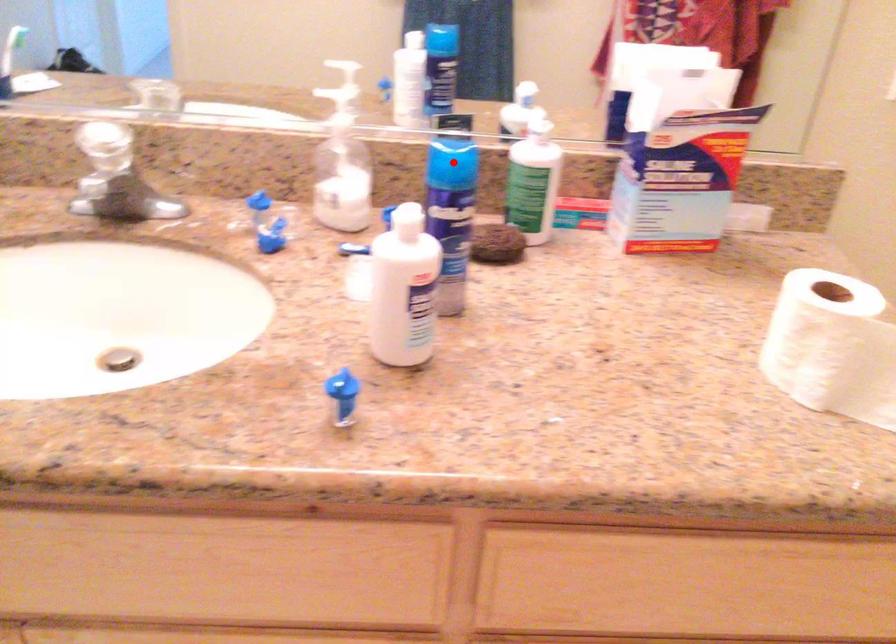
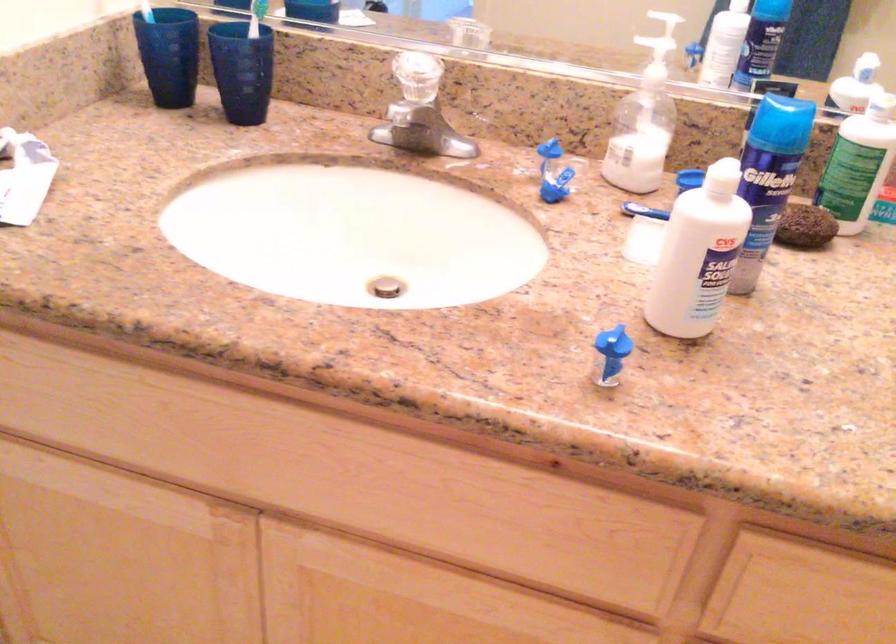
Find the pixel in the second image that matches the highlighted location in the first image.

(780, 124)